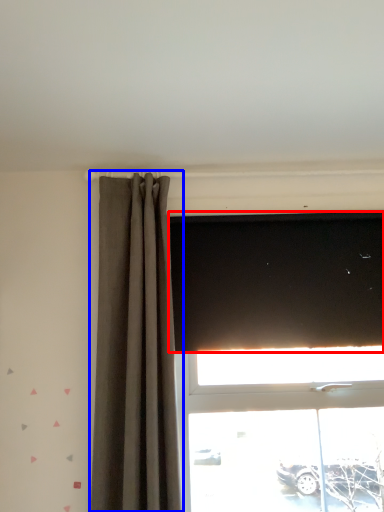
Question: Which point is closer to the camera, blind (highlighted by a red box) or curtain (highlighted by a blue box)?

Choices:
 (A) blind
 (B) curtain

Answer: (B)